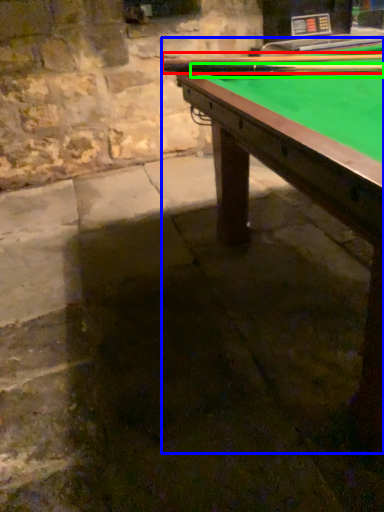
Question: Which object is positioned farthest from cue (highlighted by a red box)? Select from billiard table (highlighted by a blue box) and cue (highlighted by a green box).

Choices:
 (A) billiard table
 (B) cue

Answer: (A)